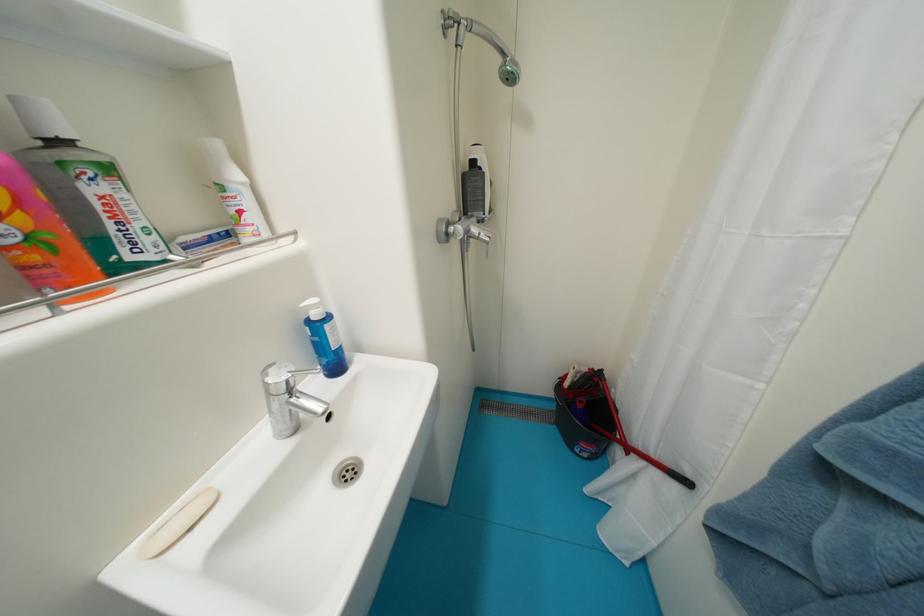
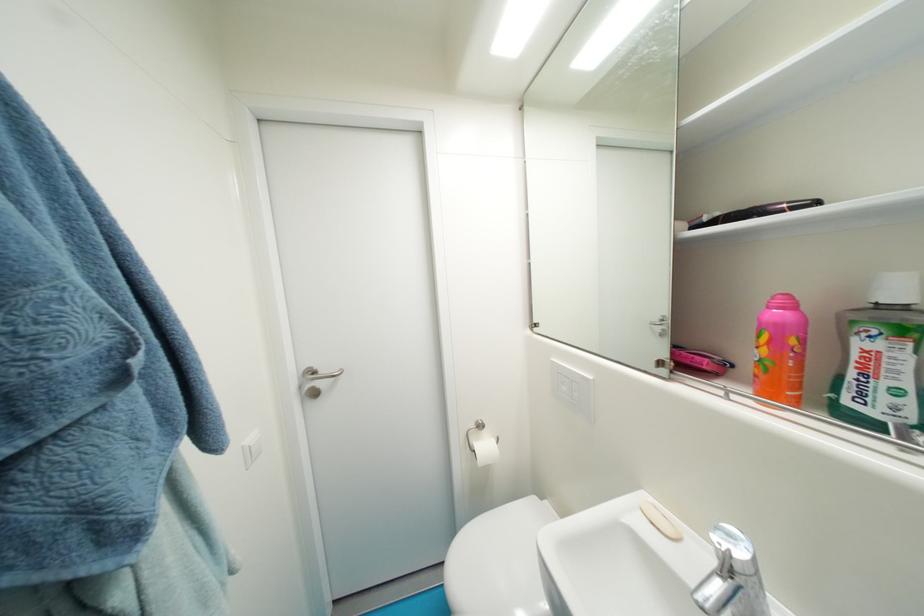
The point at (296, 375) is marked in the first image. Where is the corresponding point in the second image?

(736, 553)